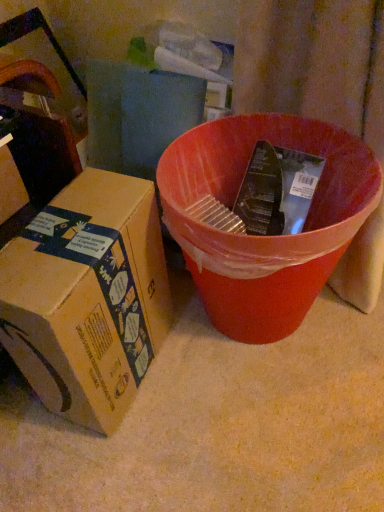
Question: Can you confirm if brown cardboard box at left, which is the 1th box from right to left, is shorter than brown cardboard box at left, positioned as the first box in left-to-right order?

Choices:
 (A) no
 (B) yes

Answer: (A)

Question: Is brown cardboard box at left, arranged as the 2th box when viewed from the left, wider than brown cardboard box at left, positioned as the first box in left-to-right order?

Choices:
 (A) yes
 (B) no

Answer: (A)

Question: From the image's perspective, does brown cardboard box at left, arranged as the 2th box when viewed from the left, appear lower than brown cardboard box at left, positioned as the first box in left-to-right order?

Choices:
 (A) no
 (B) yes

Answer: (B)

Question: Does brown cardboard box at left, arranged as the 2th box when viewed from the left, have a larger size compared to brown cardboard box at left, arranged as the 2th box when viewed from the right?

Choices:
 (A) no
 (B) yes

Answer: (B)

Question: Is brown cardboard box at left, arranged as the 2th box when viewed from the left, next to brown cardboard box at left, arranged as the 2th box when viewed from the right?

Choices:
 (A) yes
 (B) no

Answer: (B)

Question: In the image, is brown cardboard box at left, arranged as the 2th box when viewed from the left, positioned in front of or behind brown cardboard box at left, positioned as the first box in left-to-right order?

Choices:
 (A) behind
 (B) front

Answer: (A)

Question: Would you say brown cardboard box at left, arranged as the 2th box when viewed from the left, is to the left or to the right of brown cardboard box at left, positioned as the first box in left-to-right order, in the picture?

Choices:
 (A) right
 (B) left

Answer: (A)

Question: Is brown cardboard box at left, which is the 1th box from right to left, wider or thinner than brown cardboard box at left, positioned as the first box in left-to-right order?

Choices:
 (A) thin
 (B) wide

Answer: (B)

Question: From a real-world perspective, is brown cardboard box at left, which is the 1th box from right to left, positioned above or below brown cardboard box at left, positioned as the first box in left-to-right order?

Choices:
 (A) below
 (B) above

Answer: (A)

Question: In terms of height, does matte plastic bucket at center look taller or shorter compared to brown cardboard box at left, arranged as the 2th box when viewed from the right?

Choices:
 (A) short
 (B) tall

Answer: (B)

Question: From a real-world perspective, is matte plastic bucket at center physically located above or below brown cardboard box at left, positioned as the first box in left-to-right order?

Choices:
 (A) above
 (B) below

Answer: (B)

Question: From the image's perspective, is matte plastic bucket at center above or below brown cardboard box at left, positioned as the first box in left-to-right order?

Choices:
 (A) below
 (B) above

Answer: (A)

Question: Considering the positions of matte plastic bucket at center and brown cardboard box at left, arranged as the 2th box when viewed from the right, in the image, is matte plastic bucket at center wider or thinner than brown cardboard box at left, arranged as the 2th box when viewed from the right,?

Choices:
 (A) thin
 (B) wide

Answer: (B)

Question: Does point (11, 170) appear closer or farther from the camera than point (152, 294)?

Choices:
 (A) farther
 (B) closer

Answer: (B)

Question: From the image's perspective, is brown cardboard box at left, positioned as the first box in left-to-right order, above or below brown cardboard box at left, which is the 1th box from right to left?

Choices:
 (A) above
 (B) below

Answer: (A)